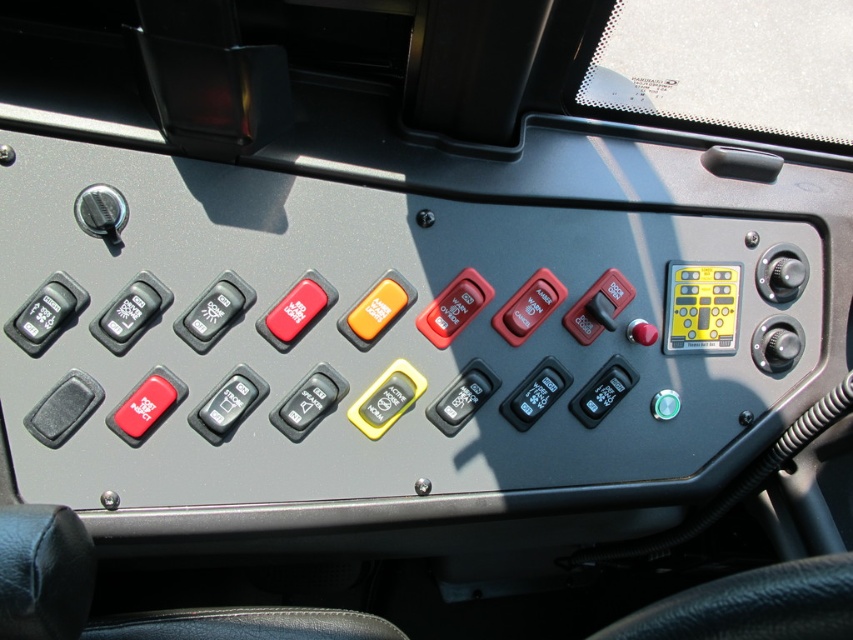
Question: Can you confirm if yellow matte keypad at upper right is smaller than satin black knob at right?

Choices:
 (A) no
 (B) yes

Answer: (A)

Question: Is yellow matte keypad at upper right closer to camera compared to metallic knob at upper left?

Choices:
 (A) no
 (B) yes

Answer: (A)

Question: Which object appears closest to the camera in this image?

Choices:
 (A) satin black knob at right
 (B) yellow matte keypad at upper right
 (C) metallic knob at upper left

Answer: (C)

Question: Does yellow matte keypad at upper right appear under satin black knob at right?

Choices:
 (A) no
 (B) yes

Answer: (B)

Question: Which object is farther from the camera taking this photo?

Choices:
 (A) yellow matte keypad at upper right
 (B) satin black knob at right

Answer: (B)

Question: Considering the real-world distances, which object is farthest from the satin black knob at right?

Choices:
 (A) metallic knob at upper left
 (B) yellow matte keypad at upper right

Answer: (A)